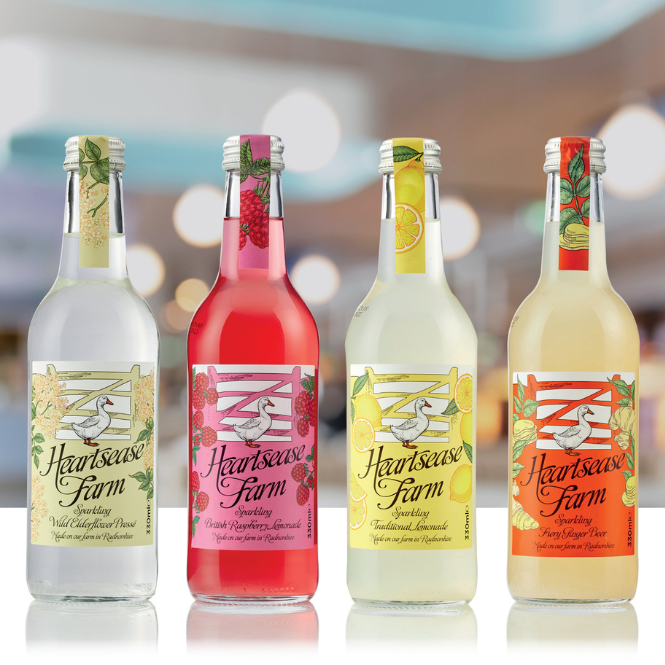
I want to click on counter, so click(x=654, y=537).